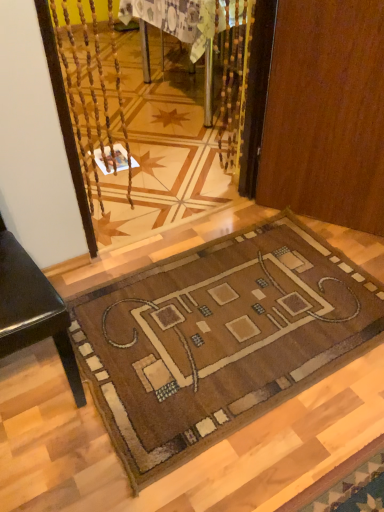
Question: Considering the relative sizes of brown woven mat at lower center and wooden table at center in the image provided, is brown woven mat at lower center taller than wooden table at center?

Choices:
 (A) yes
 (B) no

Answer: (B)

Question: Is brown woven mat at lower center closer to the viewer compared to wooden table at center?

Choices:
 (A) no
 (B) yes

Answer: (B)

Question: Is brown woven mat at lower center facing towards wooden table at center?

Choices:
 (A) no
 (B) yes

Answer: (A)

Question: From a real-world perspective, is brown woven mat at lower center beneath wooden table at center?

Choices:
 (A) yes
 (B) no

Answer: (A)

Question: Is brown woven mat at lower center oriented away from wooden table at center?

Choices:
 (A) yes
 (B) no

Answer: (B)

Question: From the image's perspective, is brown woven mat at lower center above or below brown wood door at center?

Choices:
 (A) above
 (B) below

Answer: (B)

Question: Is brown woven mat at lower center wider or thinner than brown wood door at center?

Choices:
 (A) thin
 (B) wide

Answer: (B)

Question: Would you say brown woven mat at lower center is to the left or to the right of brown wood door at center in the picture?

Choices:
 (A) right
 (B) left

Answer: (B)

Question: Considering the positions of point (109, 295) and point (332, 181), is point (109, 295) closer or farther from the camera than point (332, 181)?

Choices:
 (A) farther
 (B) closer

Answer: (B)

Question: In terms of width, does wooden table at center look wider or thinner when compared to brown woven mat at lower center?

Choices:
 (A) thin
 (B) wide

Answer: (B)

Question: Is wooden table at center in front of or behind brown woven mat at lower center in the image?

Choices:
 (A) behind
 (B) front

Answer: (A)

Question: From the image's perspective, is wooden table at center positioned above or below brown woven mat at lower center?

Choices:
 (A) below
 (B) above

Answer: (B)

Question: From a real-world perspective, is wooden table at center above or below brown woven mat at lower center?

Choices:
 (A) below
 (B) above

Answer: (B)

Question: From a real-world perspective, is brown wood door at center physically located above or below brown woven mat at lower center?

Choices:
 (A) above
 (B) below

Answer: (A)

Question: Would you say brown wood door at center is inside or outside brown woven mat at lower center?

Choices:
 (A) inside
 (B) outside

Answer: (B)